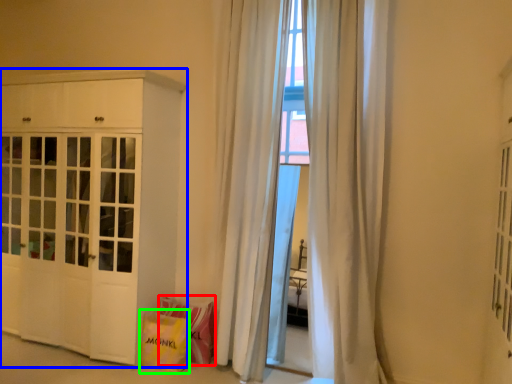
Question: Which object is positioned farthest from shopping bag (highlighted by a red box)? Select from cabinetry (highlighted by a blue box) and shopping bag (highlighted by a green box).

Choices:
 (A) cabinetry
 (B) shopping bag

Answer: (A)